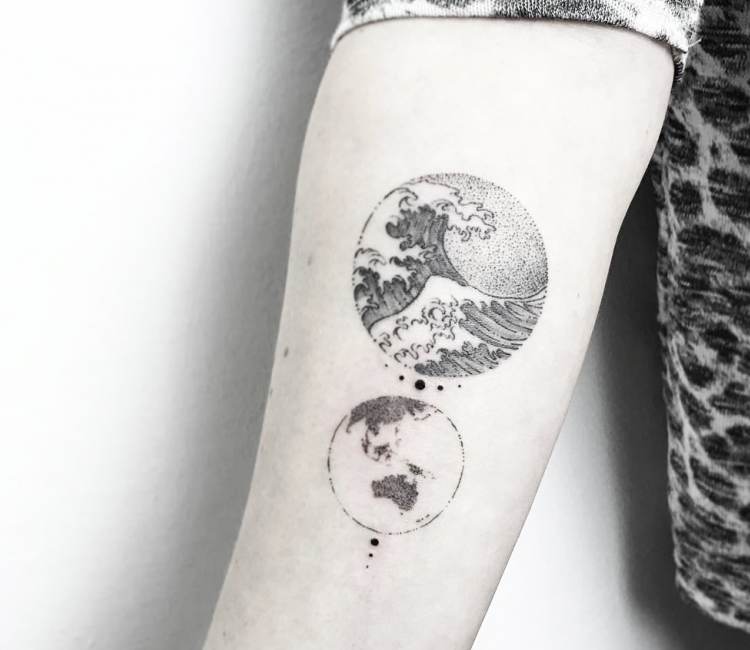
Find the location of a particular element. The image size is (750, 650). globe is located at coordinates (405, 419).